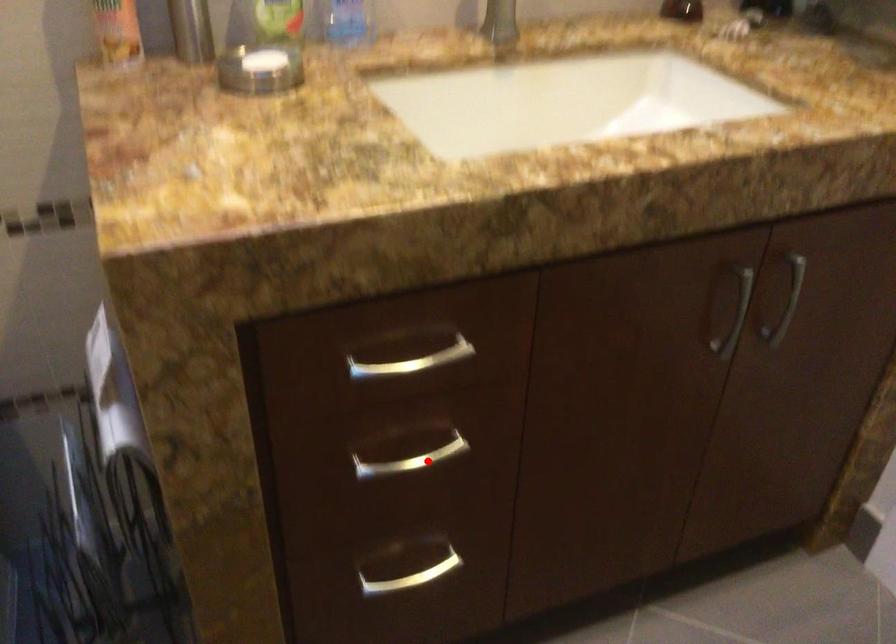
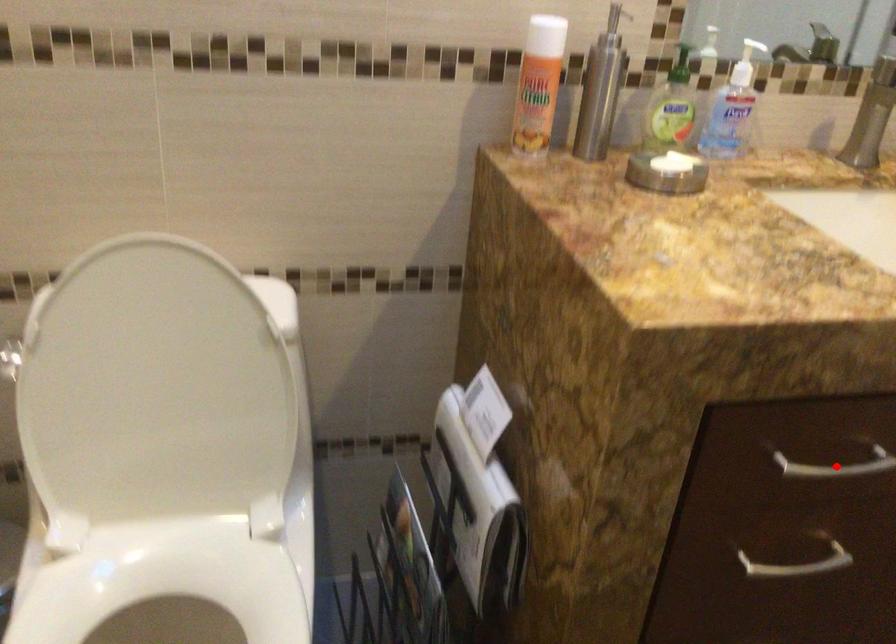
I am providing you with two images of the same scene from different viewpoints. A red point is marked on the first image and another point is marked on the second image. Do the highlighted points in image1 and image2 indicate the same real-world spot?

No